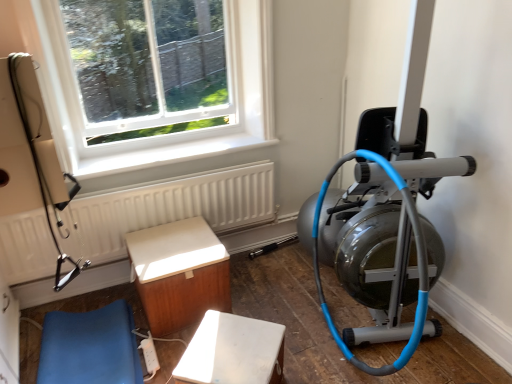
Question: Is silver metallic stationary bicycle at right oriented away from white textured radiator at upper left?

Choices:
 (A) yes
 (B) no

Answer: (B)

Question: Does silver metallic stationary bicycle at right turn towards white textured radiator at upper left?

Choices:
 (A) no
 (B) yes

Answer: (B)

Question: Does silver metallic stationary bicycle at right have a lesser width compared to white textured radiator at upper left?

Choices:
 (A) no
 (B) yes

Answer: (A)

Question: Would you say silver metallic stationary bicycle at right is a long distance from white textured radiator at upper left?

Choices:
 (A) no
 (B) yes

Answer: (A)

Question: From a real-world perspective, is silver metallic stationary bicycle at right beneath white textured radiator at upper left?

Choices:
 (A) no
 (B) yes

Answer: (A)

Question: Considering the relative positions of silver metallic stationary bicycle at right and white textured radiator at upper left in the image provided, is silver metallic stationary bicycle at right in front of white textured radiator at upper left?

Choices:
 (A) yes
 (B) no

Answer: (A)

Question: Can you confirm if white plastic extension cord at lower center is shorter than blue leather cushion at lower left, the first furniture when ordered from left to right?

Choices:
 (A) yes
 (B) no

Answer: (A)

Question: Could you tell me if white plastic extension cord at lower center is facing blue leather cushion at lower left, the first furniture when ordered from left to right?

Choices:
 (A) yes
 (B) no

Answer: (B)

Question: Is white plastic extension cord at lower center placed right next to blue leather cushion at lower left, the first furniture when ordered from left to right?

Choices:
 (A) yes
 (B) no

Answer: (B)

Question: Is the depth of white plastic extension cord at lower center less than that of blue leather cushion at lower left, the 3th furniture when ordered from right to left?

Choices:
 (A) no
 (B) yes

Answer: (A)

Question: Is white plastic extension cord at lower center wider than blue leather cushion at lower left, the first furniture when ordered from left to right?

Choices:
 (A) yes
 (B) no

Answer: (B)

Question: From the image's perspective, does white plastic extension cord at lower center appear lower than blue leather cushion at lower left, the 3th furniture when ordered from right to left?

Choices:
 (A) no
 (B) yes

Answer: (B)

Question: Can you confirm if blue leather cushion at lower left, the first furniture when ordered from left to right, is positioned to the left of white plastic window at upper left?

Choices:
 (A) no
 (B) yes

Answer: (B)